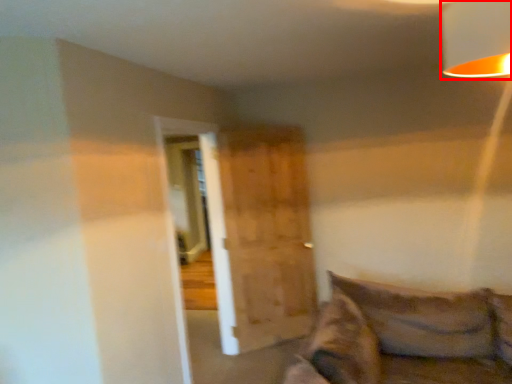
Question: Considering the relative positions of lamp (annotated by the red box) and barn door in the image provided, where is lamp (annotated by the red box) located with respect to the staircase?

Choices:
 (A) right
 (B) left

Answer: (A)